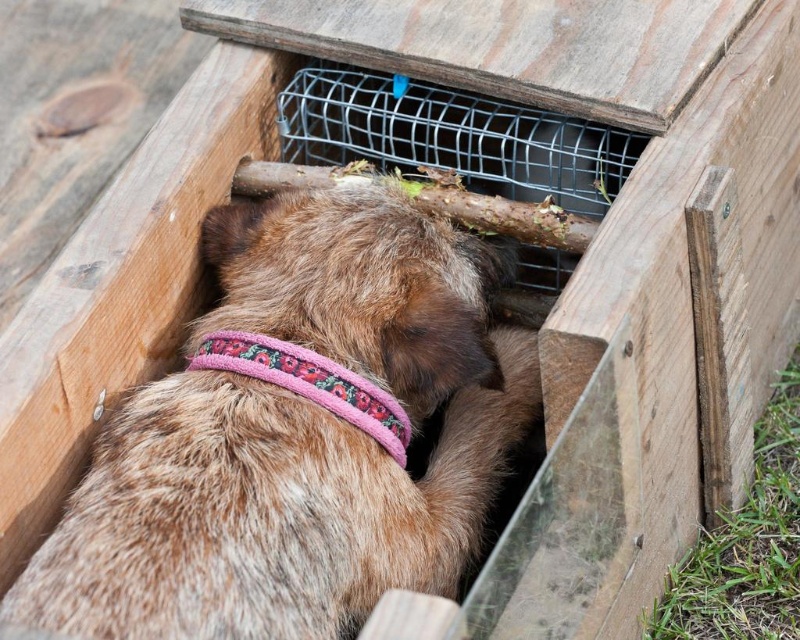
You are a photographer trying to capture the dog and the enclosure in the image. You want to focus on the point closer to you. Which point should you choose between point (458, 560) and point (370, 394)?

Point (370, 394) is closer to you than point (458, 560), so you should choose point (370, 394) to focus on the point closer to you.

Where is the brown furry dog at center located in the image?

The brown furry dog at center is located at point 0.681 on the x axis and 0.372 on the y axis.

Looking at this image, you are a veterinarian examining the image. You need to determine if the brown furry dog at center can fit through a narrow opening that is just wide enough for the pink fabric neckband at center. Can the dog fit through the opening?

The brown furry dog at center is larger in width than the pink fabric neckband at center, so the dog cannot fit through an opening that accommodates only the neckband.